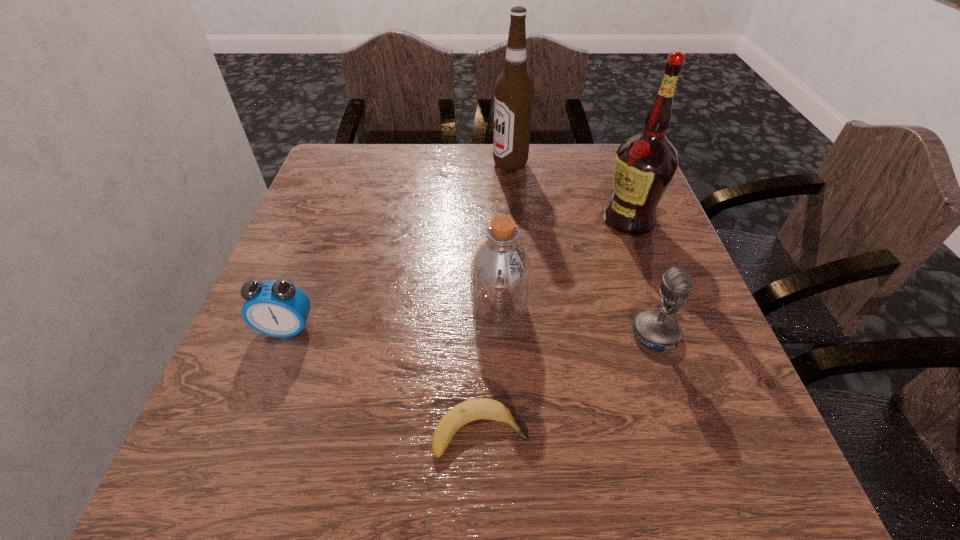
This screenshot has height=540, width=960. What are the coordinates of `vacant area situated on the face of the leftmost object` in the screenshot? It's located at (274, 363).

Identify the location of free space located 0.080m on the back of the banana. (480, 362).

Locate an element on the screen. The height and width of the screenshot is (540, 960). object that is at the far edge is located at coordinates (513, 96).

The height and width of the screenshot is (540, 960). Find the location of `object present at the near edge`. object present at the near edge is located at coordinates (465, 412).

Where is `object situated at the left edge`? object situated at the left edge is located at coordinates (278, 308).

At what (x,y) coordinates should I click in order to perform the action: click on alcohol positioned at the right edge. Please return your answer as a coordinate pair (x, y). Looking at the image, I should click on (644, 165).

Identify the location of microphone present at the right edge. (656, 330).

In the image, there is a desktop. Where is `vacant space at the far edge`? Image resolution: width=960 pixels, height=540 pixels. vacant space at the far edge is located at coordinates (402, 183).

Identify the location of free location at the near edge. (384, 476).

I want to click on free space at the left edge of the desktop, so click(331, 338).